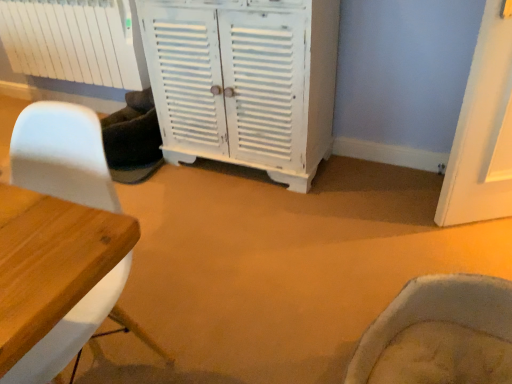
Question: From a real-world perspective, is white matte radiator at upper left located higher than white matte chair at left?

Choices:
 (A) no
 (B) yes

Answer: (B)

Question: Does white matte radiator at upper left turn towards white matte chair at left?

Choices:
 (A) yes
 (B) no

Answer: (B)

Question: Is white matte radiator at upper left smaller than white matte chair at left?

Choices:
 (A) no
 (B) yes

Answer: (B)

Question: Considering the relative sizes of white matte radiator at upper left and white matte chair at left in the image provided, is white matte radiator at upper left shorter than white matte chair at left?

Choices:
 (A) no
 (B) yes

Answer: (B)

Question: From a real-world perspective, is white matte radiator at upper left under white matte chair at left?

Choices:
 (A) yes
 (B) no

Answer: (B)

Question: Is white matte radiator at upper left located outside white matte chair at left?

Choices:
 (A) yes
 (B) no

Answer: (A)

Question: Does white painted wood cabinet at center appear on the left side of white matte chair at left?

Choices:
 (A) yes
 (B) no

Answer: (B)

Question: From the image's perspective, would you say white painted wood cabinet at center is shown under white matte chair at left?

Choices:
 (A) no
 (B) yes

Answer: (A)

Question: Is white painted wood cabinet at center far away from white matte chair at left?

Choices:
 (A) no
 (B) yes

Answer: (B)

Question: Does white painted wood cabinet at center contain white matte chair at left?

Choices:
 (A) yes
 (B) no

Answer: (B)

Question: Considering the relative positions of white painted wood cabinet at center and white matte chair at left in the image provided, is white painted wood cabinet at center to the right of white matte chair at left from the viewer's perspective?

Choices:
 (A) no
 (B) yes

Answer: (B)

Question: Considering the relative sizes of white painted wood cabinet at center and white matte chair at left in the image provided, is white painted wood cabinet at center taller than white matte chair at left?

Choices:
 (A) yes
 (B) no

Answer: (A)

Question: From a real-world perspective, is white matte chair at left located higher than white painted wood cabinet at center?

Choices:
 (A) yes
 (B) no

Answer: (B)